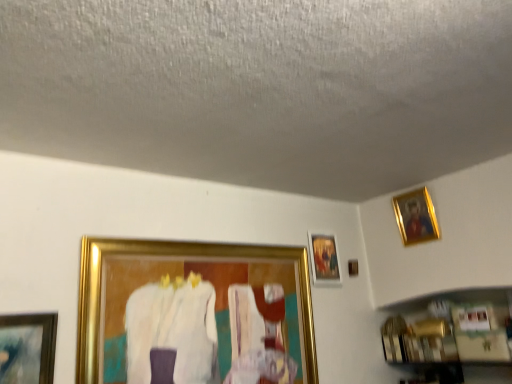
Question: Is the position of gold metallic picture frame at upper right, which is counted as the first picture frame, starting from the right, less distant than that of gold-framed painting at upper right, which is the second picture frame from left to right?

Choices:
 (A) no
 (B) yes

Answer: (B)

Question: Can you confirm if gold metallic picture frame at upper right, the 3th picture frame positioned from the left, is thinner than gold-framed painting at upper right, which is the second picture frame from left to right?

Choices:
 (A) yes
 (B) no

Answer: (B)

Question: From a real-world perspective, is gold metallic picture frame at upper right, which is counted as the first picture frame, starting from the right, beneath gold-framed painting at upper right, which is the second picture frame from left to right?

Choices:
 (A) no
 (B) yes

Answer: (A)

Question: Would you say gold metallic picture frame at upper right, the 3th picture frame positioned from the left, is a long distance from gold-framed painting at upper right, which is counted as the second picture frame, starting from the right?

Choices:
 (A) no
 (B) yes

Answer: (A)

Question: Is gold metallic picture frame at upper right, the 3th picture frame positioned from the left, wider than gold-framed painting at upper right, which is the second picture frame from left to right?

Choices:
 (A) no
 (B) yes

Answer: (B)

Question: Is gold metallic picture frame at upper right, which is counted as the first picture frame, starting from the right, facing away from gold-framed painting at upper right, which is the second picture frame from left to right?

Choices:
 (A) yes
 (B) no

Answer: (B)

Question: Is gold-framed painting at upper right, which is counted as the second picture frame, starting from the right, smaller than gold metallic picture frame at center-left, arranged as the third picture frame when viewed from the right?

Choices:
 (A) no
 (B) yes

Answer: (B)

Question: Is the position of gold-framed painting at upper right, which is counted as the second picture frame, starting from the right, less distant than that of gold metallic picture frame at center-left, arranged as the third picture frame when viewed from the right?

Choices:
 (A) no
 (B) yes

Answer: (A)

Question: Is gold-framed painting at upper right, which is counted as the second picture frame, starting from the right, not within gold metallic picture frame at center-left, arranged as the third picture frame when viewed from the right?

Choices:
 (A) yes
 (B) no

Answer: (A)

Question: Is gold metallic picture frame at center-left, arranged as the third picture frame when viewed from the right, completely or partially inside gold-framed painting at upper right, which is the second picture frame from left to right?

Choices:
 (A) yes
 (B) no

Answer: (B)

Question: Is gold-framed painting at upper right, which is counted as the second picture frame, starting from the right, not near gold metallic picture frame at center-left, which is the first picture frame from left to right?

Choices:
 (A) yes
 (B) no

Answer: (B)

Question: From a real-world perspective, is gold-framed painting at upper right, which is counted as the second picture frame, starting from the right, on top of gold metallic picture frame at center-left, which is the first picture frame from left to right?

Choices:
 (A) no
 (B) yes

Answer: (B)

Question: Is the position of gold metallic picture frame at center-left, arranged as the third picture frame when viewed from the right, less distant than that of gold metallic picture frame at upper right, the 3th picture frame positioned from the left?

Choices:
 (A) yes
 (B) no

Answer: (A)